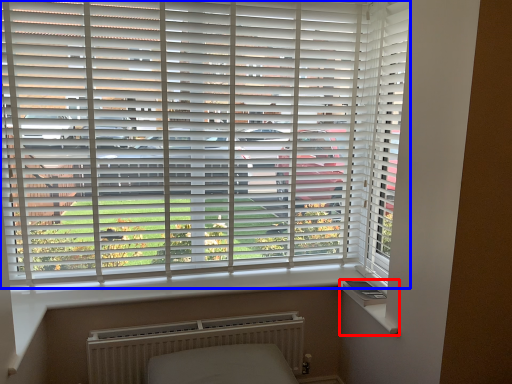
Question: Which point is further to the camera, window sill (highlighted by a red box) or window blind (highlighted by a blue box)?

Choices:
 (A) window sill
 (B) window blind

Answer: (A)